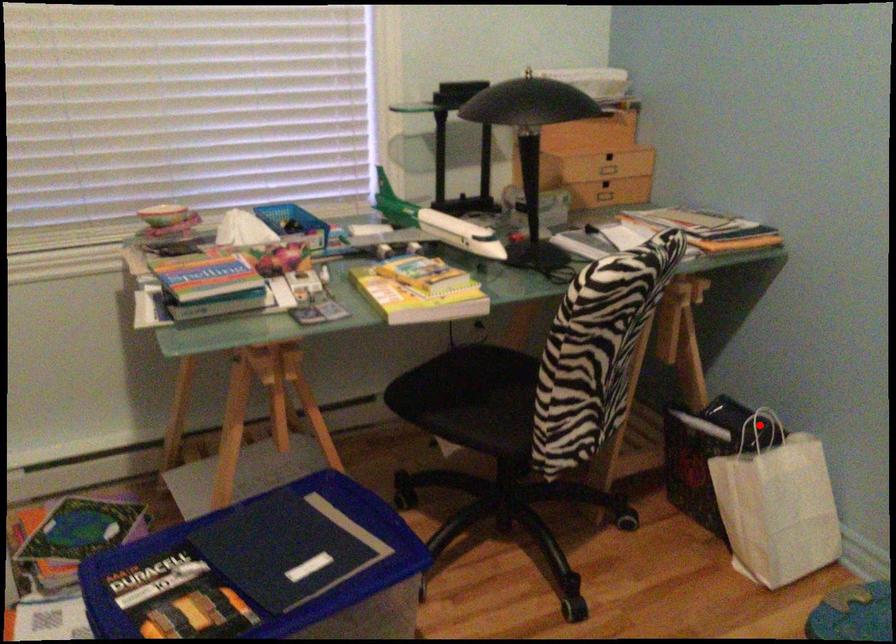
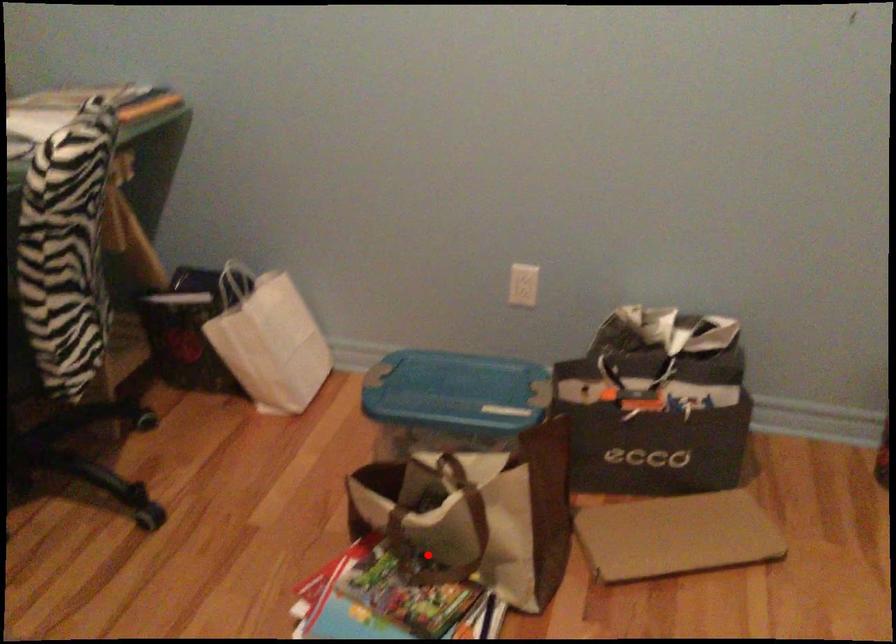
Consider the image. I am providing you with two images of the same scene from different viewpoints. A red point is marked on the first image and another point is marked on the second image. Are the points marked in image1 and image2 representing the same 3D position?

No